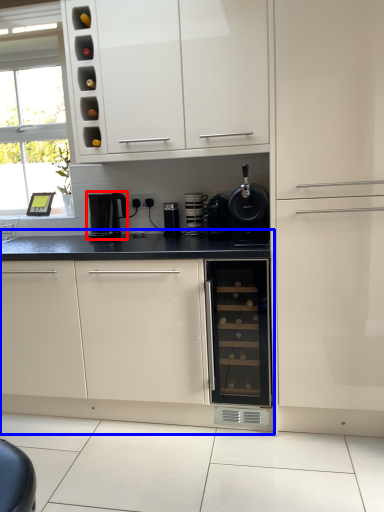
Question: Which object is further to the camera taking this photo, kitchen appliance (highlighted by a red box) or cabinetry (highlighted by a blue box)?

Choices:
 (A) kitchen appliance
 (B) cabinetry

Answer: (A)